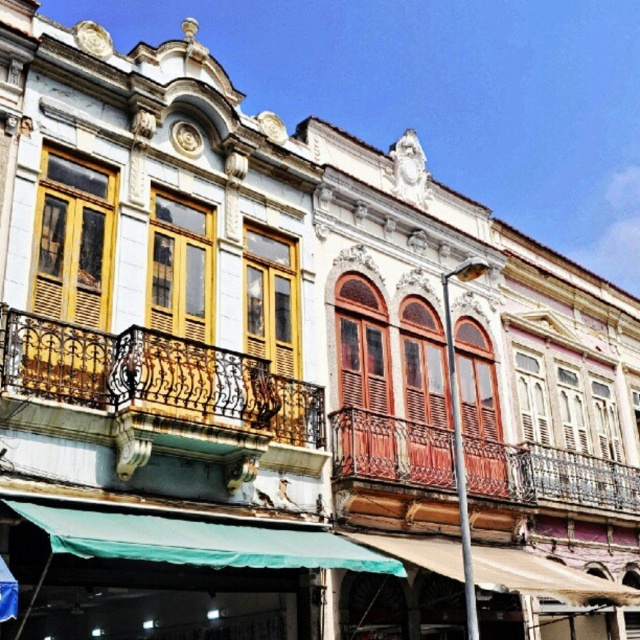
Can you confirm if rusty metal balcony at left is positioned above rustic wood balcony at center?

Indeed, rusty metal balcony at left is positioned over rustic wood balcony at center.

Is rusty metal balcony at left positioned in front of rustic wood balcony at center?

Yes, rusty metal balcony at left is in front of rustic wood balcony at center.

Locate an element on the screen. rusty metal balcony at left is located at coordinates (156, 394).